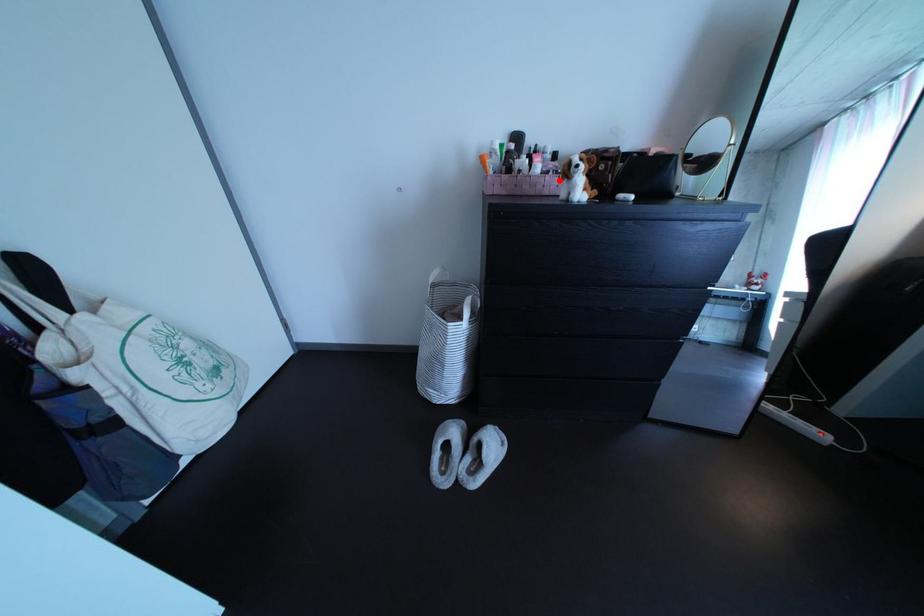
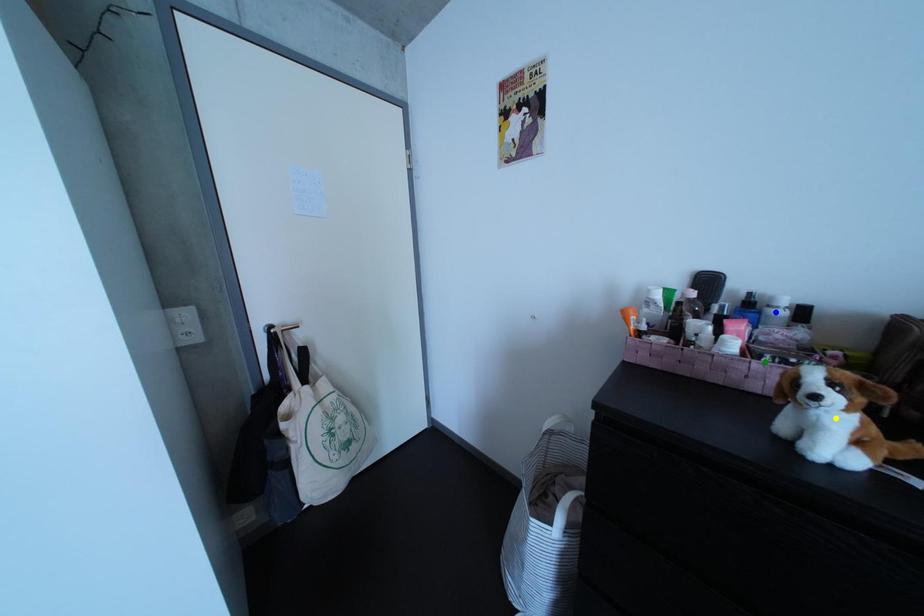
Question: I am providing you with two images of the same scene from different viewpoints. A red point is marked on the first image. You are given multiple points on the second image. Which point in image 2 represents the same 3d spot as the red point in image 1?

Choices:
 (A) yellow point
 (B) green point
 (C) blue point

Answer: (B)